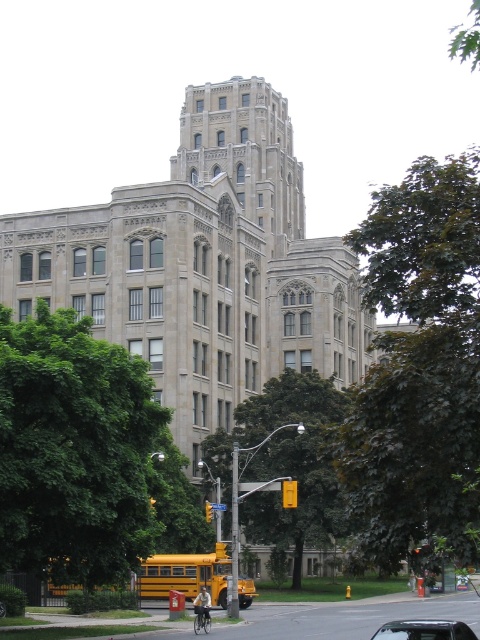
You are a pedestrian standing on the sidewalk in front of the building. You see the dark green leafy tree at center and the green leafy tree at left. Which tree is closer to the street?

The green leafy tree at left is closer to the street because it is positioned to the left of the dark green leafy tree at center, which is further to the right.